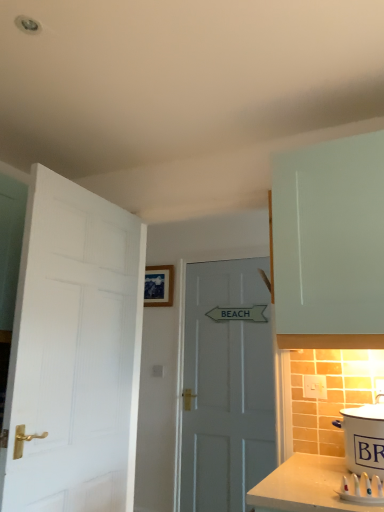
Question: Is white ceramic pot at lower right closer to camera compared to white plastic electric outlet at lower right?

Choices:
 (A) no
 (B) yes

Answer: (B)

Question: From the image's perspective, is white ceramic pot at lower right located above white plastic electric outlet at lower right?

Choices:
 (A) no
 (B) yes

Answer: (A)

Question: Does white ceramic pot at lower right have a greater width compared to white plastic electric outlet at lower right?

Choices:
 (A) yes
 (B) no

Answer: (A)

Question: Does white ceramic pot at lower right have a lesser width compared to white plastic electric outlet at lower right?

Choices:
 (A) no
 (B) yes

Answer: (A)

Question: From a real-world perspective, is white ceramic pot at lower right positioned over white plastic electric outlet at lower right based on gravity?

Choices:
 (A) yes
 (B) no

Answer: (B)

Question: Is white ceramic pot at lower right in contact with white plastic electric outlet at lower right?

Choices:
 (A) no
 (B) yes

Answer: (A)

Question: From the image's perspective, is white plastic electric outlet at lower right located above white ceramic pot at lower right?

Choices:
 (A) yes
 (B) no

Answer: (A)

Question: From the image's perspective, does white plastic electric outlet at lower right appear lower than white ceramic pot at lower right?

Choices:
 (A) yes
 (B) no

Answer: (B)

Question: Considering the relative positions of white plastic electric outlet at lower right and white ceramic pot at lower right in the image provided, is white plastic electric outlet at lower right in front of white ceramic pot at lower right?

Choices:
 (A) no
 (B) yes

Answer: (A)

Question: Is white plastic electric outlet at lower right facing away from white ceramic pot at lower right?

Choices:
 (A) yes
 (B) no

Answer: (B)

Question: Does white plastic electric outlet at lower right appear on the left side of white ceramic pot at lower right?

Choices:
 (A) no
 (B) yes

Answer: (B)

Question: Is white ceramic pot at lower right inside white plastic electric outlet at lower right?

Choices:
 (A) yes
 (B) no

Answer: (B)

Question: From a real-world perspective, is white matte door at left, marked as the first door in a front-to-back arrangement, positioned under white wooden door at center, placed as the first door when sorted from back to front, based on gravity?

Choices:
 (A) yes
 (B) no

Answer: (B)